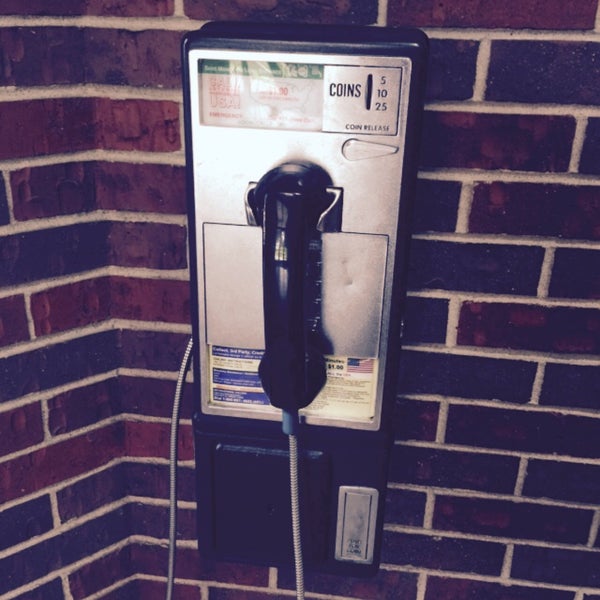
Find the location of `phone`. phone is located at coordinates 287,310.